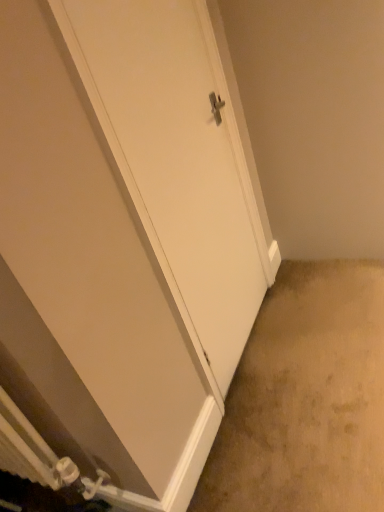
Consider the image. What is the approximate height of white matte door at center?

4.67 feet.

Describe the element at coordinates (126, 234) in the screenshot. The image size is (384, 512). I see `white matte door at center` at that location.

The width and height of the screenshot is (384, 512). Identify the location of white matte door at center. [x=126, y=234].

Find the location of a particular element. The width and height of the screenshot is (384, 512). beige carpet at lower right is located at coordinates (306, 398).

Describe the element at coordinates (306, 398) in the screenshot. I see `beige carpet at lower right` at that location.

Image resolution: width=384 pixels, height=512 pixels. I want to click on white matte door at center, so click(126, 234).

Does beige carpet at lower right appear on the right side of white matte door at center?

Indeed, beige carpet at lower right is positioned on the right side of white matte door at center.

Is beige carpet at lower right positioned in front of white matte door at center?

No.

Between point (376, 500) and point (112, 447), which one is positioned behind?

The point (376, 500) is farther from the camera.

Looking at this image, from the image's perspective, is beige carpet at lower right above or below white matte door at center?

Answer: beige carpet at lower right is below white matte door at center.

From a real-world perspective, between beige carpet at lower right and white matte door at center, who is vertically higher?

white matte door at center is physically above.

Can you confirm if beige carpet at lower right is wider than white matte door at center?

Indeed, beige carpet at lower right has a greater width compared to white matte door at center.

Between beige carpet at lower right and white matte door at center, which one has more height?

Standing taller between the two is white matte door at center.

Is beige carpet at lower right bigger than white matte door at center?

Correct, beige carpet at lower right is larger in size than white matte door at center.

Is white matte door at center inside beige carpet at lower right?

Definitely not — white matte door at center is not inside beige carpet at lower right.

Is beige carpet at lower right not near white matte door at center?

No, beige carpet at lower right is not far away from white matte door at center.

Is beige carpet at lower right facing away from white matte door at center?

That's not correct — beige carpet at lower right is not looking away from white matte door at center.

You are a GUI agent. You are given a task and a screenshot of the screen. Output one action in this format:
    pyautogui.click(x=<x>, y=<y>)
    Task: Click on the concrete below the white matte door at center (from the image's perspective)
    Image resolution: width=384 pixels, height=512 pixels.
    Given the screenshot: What is the action you would take?
    pyautogui.click(x=306, y=398)

Looking at this image, is white matte door at center at the right side of beige carpet at lower right?

Incorrect, white matte door at center is not on the right side of beige carpet at lower right.

Is white matte door at center closer to camera compared to beige carpet at lower right?

Yes, white matte door at center is closer to the viewer.

Considering the positions of point (111, 187) and point (267, 471), is point (111, 187) closer or farther from the camera than point (267, 471)?

Point (111, 187).

From the image's perspective, is white matte door at center located above or below beige carpet at lower right?

white matte door at center is above beige carpet at lower right.

From a real-world perspective, between white matte door at center and beige carpet at lower right, who is vertically lower?

beige carpet at lower right, from a real-world perspective.

In the scene shown: Which of these two, white matte door at center or beige carpet at lower right, is wider?

Wider between the two is beige carpet at lower right.

Can you confirm if white matte door at center is shorter than beige carpet at lower right?

Incorrect, the height of white matte door at center does not fall short of that of beige carpet at lower right.

Based on the photo, considering the sizes of objects white matte door at center and beige carpet at lower right in the image provided, who is bigger, white matte door at center or beige carpet at lower right?

beige carpet at lower right.

Could beige carpet at lower right be considered to be inside white matte door at center?

That's incorrect, beige carpet at lower right is not inside white matte door at center.

Is the surface of white matte door at center in direct contact with beige carpet at lower right?

No, white matte door at center is not touching beige carpet at lower right.

Is white matte door at center facing away from beige carpet at lower right?

white matte door at center does not have its back to beige carpet at lower right.

In order to click on concrete below the white matte door at center (from the image's perspective) in this screenshot , I will do `click(306, 398)`.

The height and width of the screenshot is (512, 384). Find the location of `concrete below the white matte door at center (from the image's perspective)`. concrete below the white matte door at center (from the image's perspective) is located at coordinates (306, 398).

Locate an element on the screen. The height and width of the screenshot is (512, 384). concrete located on the right of white matte door at center is located at coordinates (306, 398).